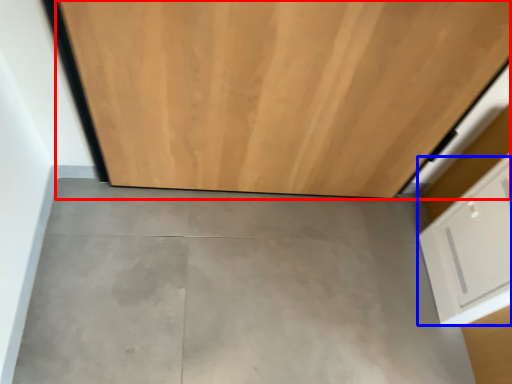
Question: Which point is closer to the camera, door (highlighted by a red box) or drawer (highlighted by a blue box)?

Choices:
 (A) door
 (B) drawer

Answer: (A)